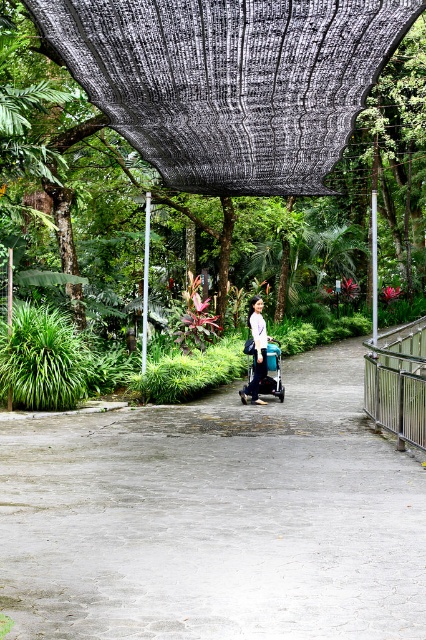
Question: Is gray concrete path at center wider than matte black stroller at center?

Choices:
 (A) no
 (B) yes

Answer: (B)

Question: Which object is closer to the camera taking this photo?

Choices:
 (A) blue fabric stroller at center
 (B) gray concrete path at center
 (C) matte black stroller at center
 (D) white fabric bag at center

Answer: (B)

Question: Among these points, which one is nearest to the camera?

Choices:
 (A) (259, 388)
 (B) (285, 116)
 (C) (192, 22)

Answer: (C)

Question: Which point appears farthest from the camera in this image?

Choices:
 (A) (236, 84)
 (B) (143, 1)

Answer: (A)

Question: Is matte black stroller at center below white fabric bag at center?

Choices:
 (A) no
 (B) yes

Answer: (A)

Question: Does matte black stroller at center have a larger size compared to black mesh canopy at upper center?

Choices:
 (A) yes
 (B) no

Answer: (B)